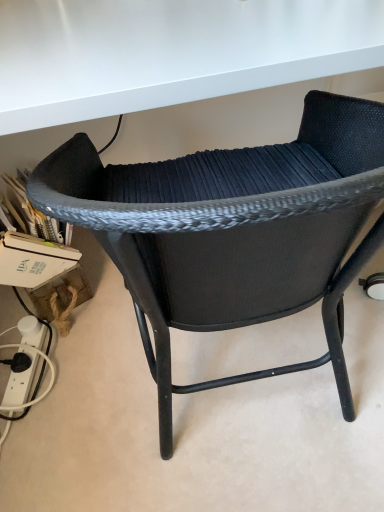
Question: From a real-world perspective, relative to black woven chair at center, is black plastic plug at lower left vertically above or below?

Choices:
 (A) below
 (B) above

Answer: (A)

Question: Considering the relative positions of black plastic plug at lower left and black woven chair at center in the image provided, is black plastic plug at lower left to the left or to the right of black woven chair at center?

Choices:
 (A) right
 (B) left

Answer: (B)

Question: In terms of size, does black plastic plug at lower left appear bigger or smaller than black woven chair at center?

Choices:
 (A) big
 (B) small

Answer: (B)

Question: From the image's perspective, is black woven chair at center located above or below black plastic plug at lower left?

Choices:
 (A) below
 (B) above

Answer: (B)

Question: In terms of size, does black woven chair at center appear bigger or smaller than black plastic plug at lower left?

Choices:
 (A) big
 (B) small

Answer: (A)

Question: Relative to black plastic plug at lower left, is black woven chair at center in front or behind?

Choices:
 (A) behind
 (B) front

Answer: (B)

Question: Considering the positions of black woven chair at center and black plastic plug at lower left in the image, is black woven chair at center taller or shorter than black plastic plug at lower left?

Choices:
 (A) tall
 (B) short

Answer: (A)